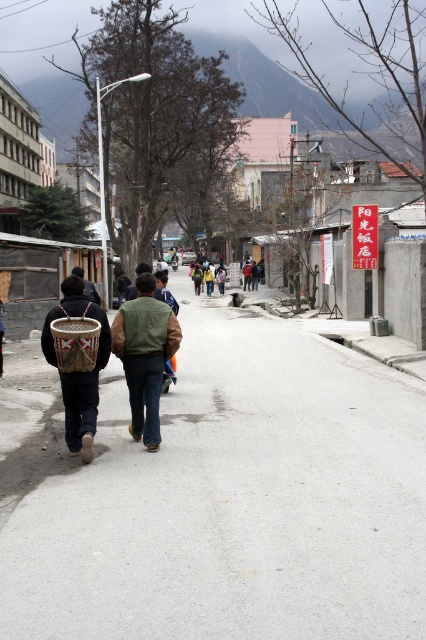
Which is below, green suede vest at center or woven brown basket at rear?

woven brown basket at rear is lower down.

Can you confirm if green suede vest at center is positioned below woven brown basket at rear?

Actually, green suede vest at center is above woven brown basket at rear.

Does point (169, 346) come behind point (97, 349)?

Yes.

Where is `green suede vest at center`? Image resolution: width=426 pixels, height=640 pixels. green suede vest at center is located at coordinates (144, 355).

Identify the location of smooth asphalt road at center. This screenshot has width=426, height=640. (218, 493).

Is smooth asphalt road at center shorter than brown woven basket at left?

Incorrect, smooth asphalt road at center's height does not fall short of brown woven basket at left's.

Which is behind, point (210, 576) or point (78, 339)?

Point (78, 339)

Locate an element on the screen. The image size is (426, 640). smooth asphalt road at center is located at coordinates (218, 493).

Which is behind, point (178, 326) or point (71, 352)?

The point (178, 326) is more distant.

This screenshot has width=426, height=640. Find the location of `green suede vest at center`. green suede vest at center is located at coordinates (144, 355).